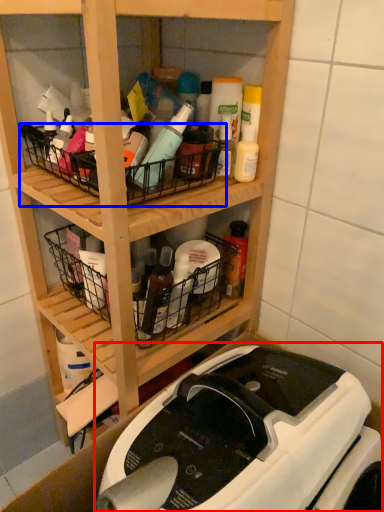
Question: Among these objects, which one is farthest to the camera, sewing machine (highlighted by a red box) or basket (highlighted by a blue box)?

Choices:
 (A) sewing machine
 (B) basket

Answer: (B)